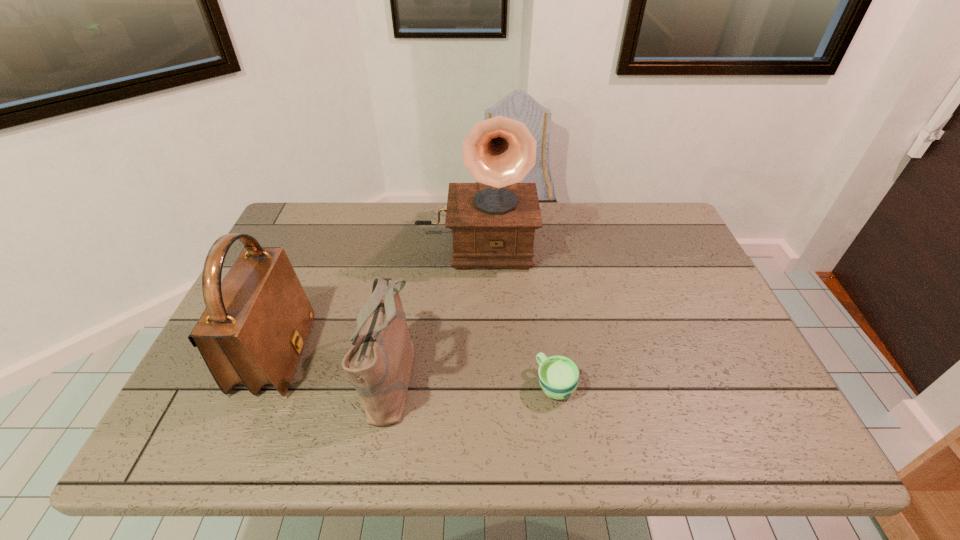
Locate an element on the screen. Image resolution: width=960 pixels, height=540 pixels. blank area in the image that satisfies the following two spatial constraints: 1. on the horn of the tallest object; 2. on the front flap of the left shoulder bag is located at coordinates (473, 355).

Image resolution: width=960 pixels, height=540 pixels. What are the coordinates of `free region that satisfies the following two spatial constraints: 1. on the horn of the shortest object; 2. on the right side of the tallest object` in the screenshot? It's located at (473, 384).

Where is `vacant region that satisfies the following two spatial constraints: 1. on the front-facing side of the right shoulder bag; 2. on the back side of the cup`? This screenshot has width=960, height=540. vacant region that satisfies the following two spatial constraints: 1. on the front-facing side of the right shoulder bag; 2. on the back side of the cup is located at coordinates (391, 384).

Find the location of `vacant position in the image that satisfies the following two spatial constraints: 1. on the back side of the shortest object; 2. on the front-facing side of the right shoulder bag`. vacant position in the image that satisfies the following two spatial constraints: 1. on the back side of the shortest object; 2. on the front-facing side of the right shoulder bag is located at coordinates (554, 375).

At what (x,y) coordinates should I click in order to perform the action: click on vacant space that satisfies the following two spatial constraints: 1. on the front flap of the cup; 2. on the left side of the leftmost object. Please return your answer as a coordinate pair (x, y). The width and height of the screenshot is (960, 540). Looking at the image, I should click on (263, 384).

Image resolution: width=960 pixels, height=540 pixels. What are the coordinates of `vacant area that satisfies the following two spatial constraints: 1. on the back side of the cup; 2. on the front-facing side of the right shoulder bag` in the screenshot? It's located at (554, 375).

Identify the location of free space that satisfies the following two spatial constraints: 1. on the front flap of the shortest object; 2. on the left side of the left shoulder bag. The image size is (960, 540). (263, 384).

This screenshot has height=540, width=960. What are the coordinates of `blank space that satisfies the following two spatial constraints: 1. on the horn of the tallest object; 2. on the front flap of the leftmost object` in the screenshot? It's located at (473, 355).

Find the location of a particular element. The width and height of the screenshot is (960, 540). free point that satisfies the following two spatial constraints: 1. on the back side of the shortest object; 2. on the front flap of the left shoulder bag is located at coordinates (551, 355).